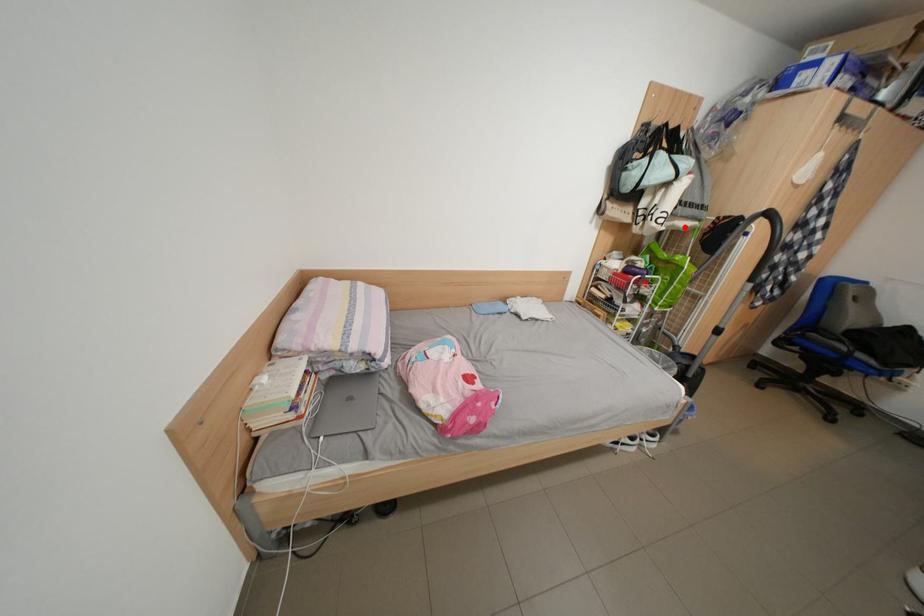
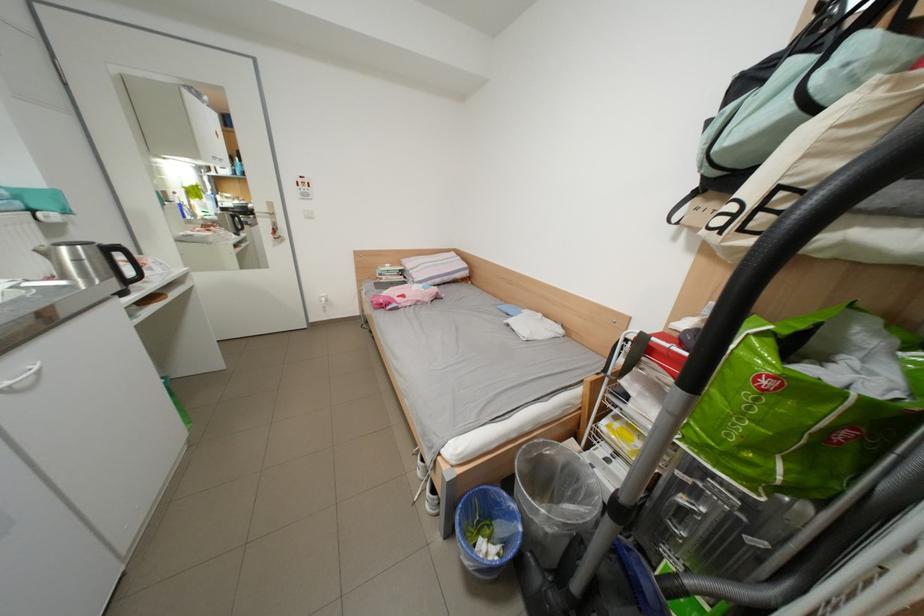
Locate, in the second image, the point that corresponds to the highlighted location in the first image.

(856, 245)